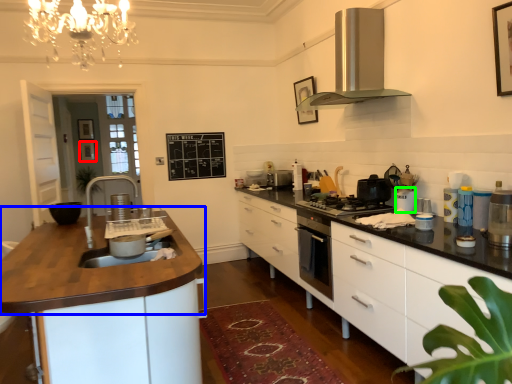
Question: Which object is the farthest from picture frame (highlighted by a red box)? Choose among these: countertop (highlighted by a blue box) or appliance (highlighted by a green box).

Choices:
 (A) countertop
 (B) appliance

Answer: (B)